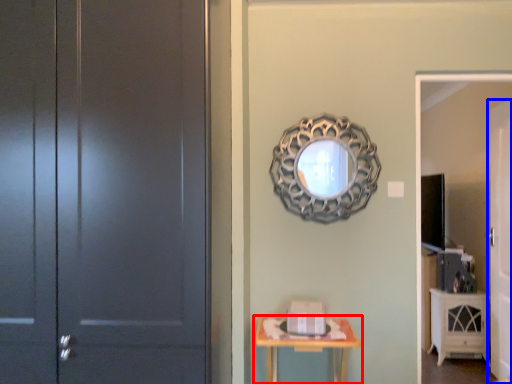
Question: Which point is closer to the camera, table (highlighted by a red box) or door (highlighted by a blue box)?

Choices:
 (A) table
 (B) door

Answer: (A)